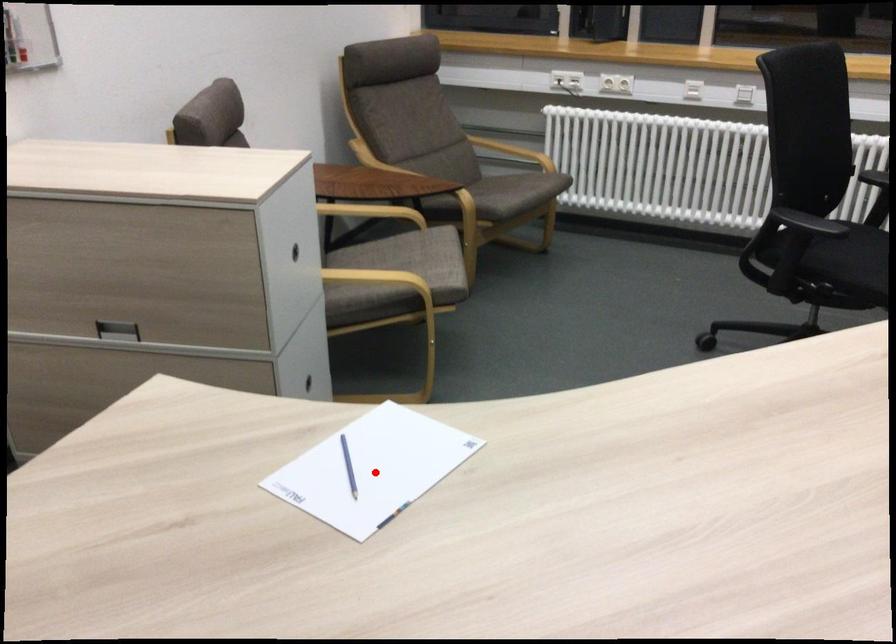
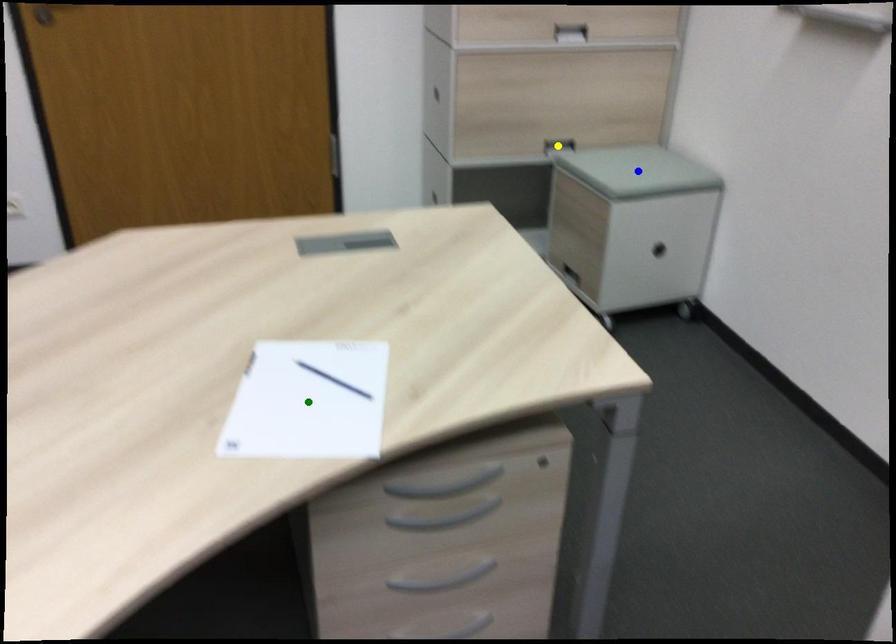
Question: I am providing you with two images of the same scene from different viewpoints. A red point is marked on the first image. You are given multiple points on the second image. Can you choose the point in image 2 that corresponds to the point in image 1?

Choices:
 (A) blue point
 (B) yellow point
 (C) green point

Answer: (C)